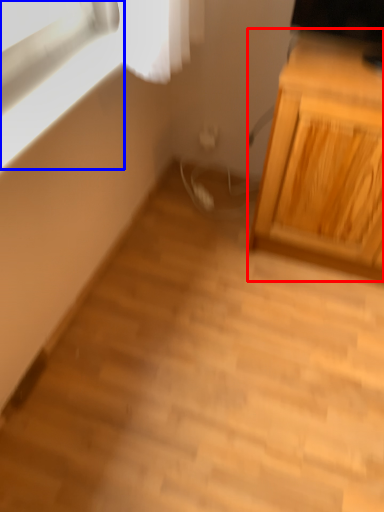
Question: Which point is further to the camera, cabinetry (highlighted by a red box) or window (highlighted by a blue box)?

Choices:
 (A) cabinetry
 (B) window

Answer: (A)